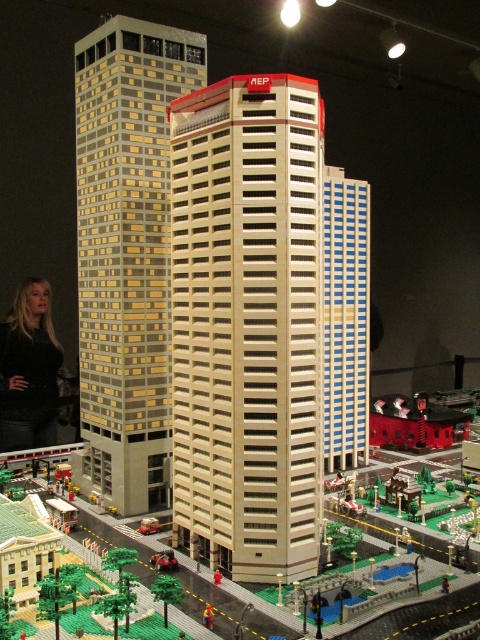
Question: Does beige brick building at center appear under black sweater at lower left?

Choices:
 (A) no
 (B) yes

Answer: (A)

Question: Is matte gold brick building at center bigger than blue/white striped building at center?

Choices:
 (A) yes
 (B) no

Answer: (A)

Question: Which object appears closest to the camera in this image?

Choices:
 (A) beige brick building at center
 (B) matte gold brick building at center
 (C) blue/white striped building at center
 (D) black sweater at lower left

Answer: (A)

Question: Is blue/white striped building at center to the left of black sweater at lower left from the viewer's perspective?

Choices:
 (A) no
 (B) yes

Answer: (A)

Question: Which of the following is the closest to the observer?

Choices:
 (A) (123, 29)
 (B) (35, 394)
 (C) (300, 456)

Answer: (C)

Question: Which point is farther to the camera?

Choices:
 (A) beige brick building at center
 (B) matte gold brick building at center

Answer: (B)